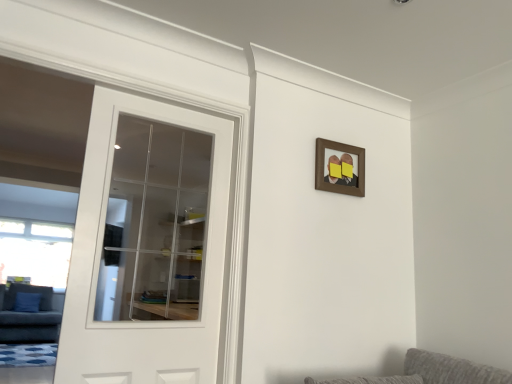
Question: Is dark gray fabric couch at left further to camera compared to white glass door at left?

Choices:
 (A) yes
 (B) no

Answer: (A)

Question: Considering the relative sizes of dark gray fabric couch at left and white glass door at left in the image provided, is dark gray fabric couch at left smaller than white glass door at left?

Choices:
 (A) no
 (B) yes

Answer: (A)

Question: Is dark gray fabric couch at left facing away from white glass door at left?

Choices:
 (A) no
 (B) yes

Answer: (A)

Question: Considering the relative sizes of dark gray fabric couch at left and white glass door at left in the image provided, is dark gray fabric couch at left thinner than white glass door at left?

Choices:
 (A) yes
 (B) no

Answer: (B)

Question: Does dark gray fabric couch at left appear on the left side of white glass door at left?

Choices:
 (A) yes
 (B) no

Answer: (A)

Question: In terms of width, does dark gray fabric couch at left look wider or thinner when compared to white glass door at left?

Choices:
 (A) wide
 (B) thin

Answer: (A)

Question: In the image, is dark gray fabric couch at left positioned in front of or behind white glass door at left?

Choices:
 (A) front
 (B) behind

Answer: (B)

Question: Considering the positions of point (7, 301) and point (152, 125), is point (7, 301) closer or farther from the camera than point (152, 125)?

Choices:
 (A) farther
 (B) closer

Answer: (A)

Question: Is dark gray fabric couch at left bigger or smaller than white glass door at left?

Choices:
 (A) big
 (B) small

Answer: (A)

Question: Is brown wooden picture frame at upper center wider or thinner than dark gray fabric couch at left?

Choices:
 (A) thin
 (B) wide

Answer: (A)

Question: Do you think brown wooden picture frame at upper center is within dark gray fabric couch at left, or outside of it?

Choices:
 (A) outside
 (B) inside

Answer: (A)

Question: Is point (352, 180) positioned closer to the camera than point (42, 307)?

Choices:
 (A) farther
 (B) closer

Answer: (B)

Question: From a real-world perspective, is brown wooden picture frame at upper center above or below dark gray fabric couch at left?

Choices:
 (A) above
 (B) below

Answer: (A)

Question: From the image's perspective, is brown wooden picture frame at upper center above or below white glass door at left?

Choices:
 (A) below
 (B) above

Answer: (B)

Question: Is brown wooden picture frame at upper center wider or thinner than white glass door at left?

Choices:
 (A) thin
 (B) wide

Answer: (A)